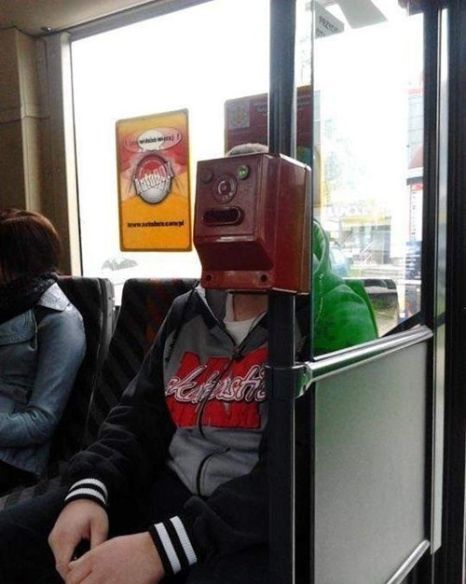
You are a GUI agent. You are given a task and a screenshot of the screen. Output one action in this format:
    pyautogui.click(x=<x>, y=<y>)
    Task: Click on the edge of seat
    The height and width of the screenshot is (584, 466).
    Given the screenshot: What is the action you would take?
    pyautogui.click(x=384, y=495)